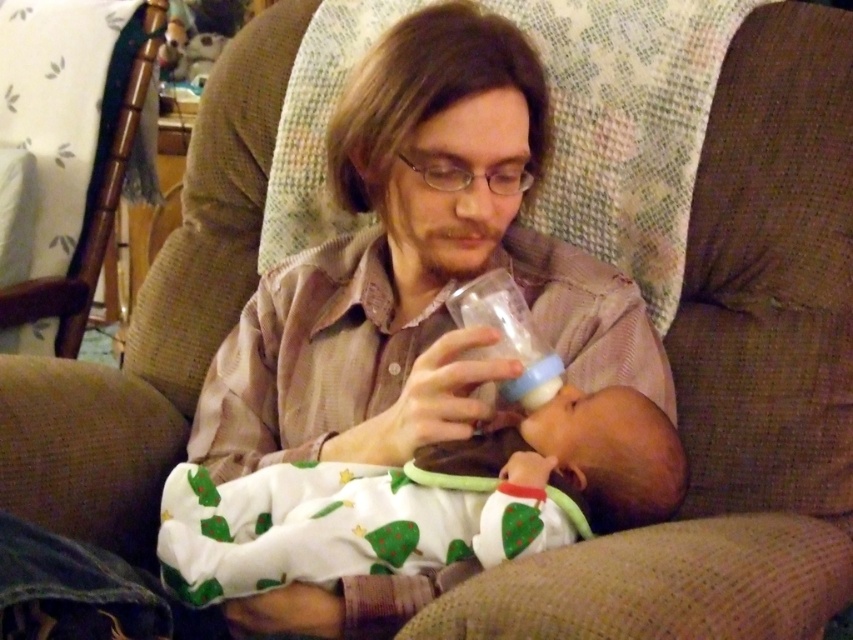
You are a photographer standing 3 feet away from the scene. You want to take a closeup photo of the white soft fabric baby at center. Is the baby within your camera range if the camera can focus as close as 30 inches?

The white soft fabric baby at center is 31.06 inches away from the viewer. Since the camera can focus as close as 30 inches, the baby is slightly beyond the minimum focus distance. Therefore, the camera may not be able to focus properly on the baby for a closeup.